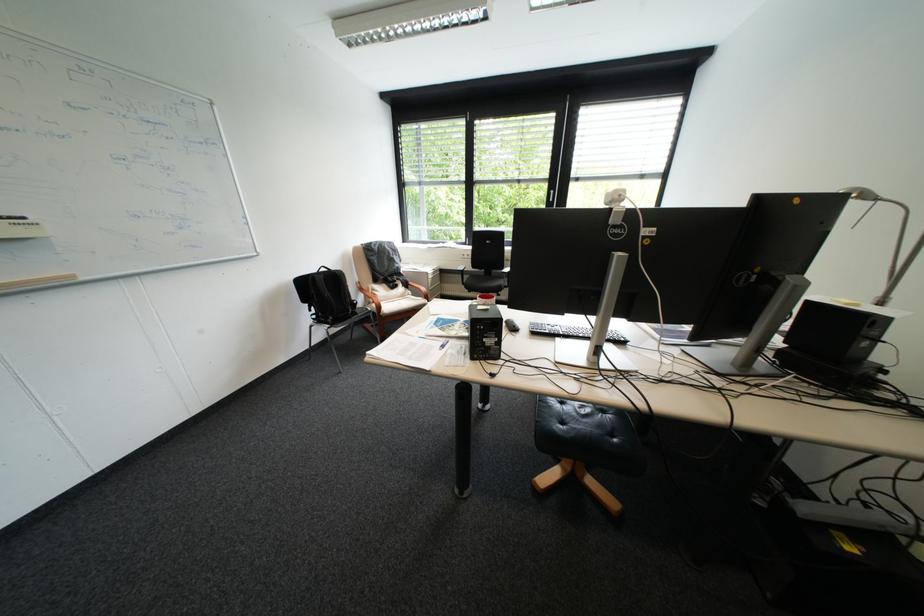
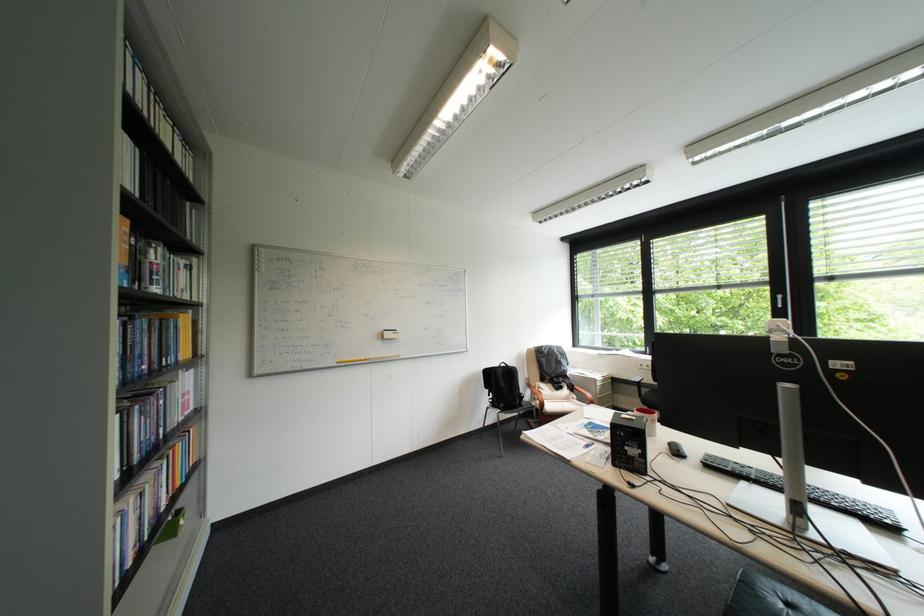
Locate, in the second image, the point that corresponds to point 558,190 in the first image.

(781, 294)